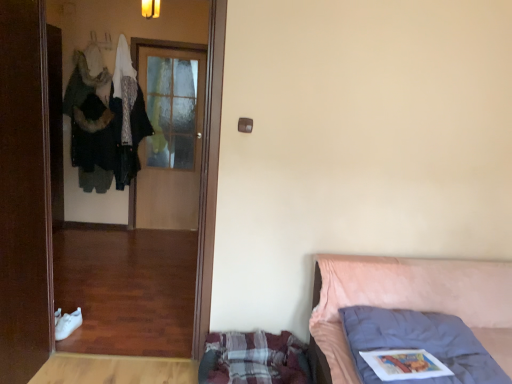
Question: From their relative heights in the image, would you say brown wooden door at left, the first door from the front, is taller or shorter than wooden door at center, which is counted as the second door, starting from the front?

Choices:
 (A) short
 (B) tall

Answer: (A)

Question: From a real-world perspective, relative to wooden door at center, which is counted as the second door, starting from the front, is brown wooden door at left, the first door from the front, vertically above or below?

Choices:
 (A) below
 (B) above

Answer: (A)

Question: Which is farther from the plaid fabric mattress at lower center?

Choices:
 (A) pink fabric bed at right
 (B) wooden screen door at left
 (C) wooden door at center, which is counted as the second door, starting from the front
 (D) brown wooden door at left, the first door from the front

Answer: (C)

Question: Estimate the real-world distances between objects in this image. Which object is farther from the wooden door at center, which is counted as the second door, starting from the front?

Choices:
 (A) plaid fabric mattress at lower center
 (B) wooden screen door at left
 (C) brown wooden door at left, marked as the 2th door in a back-to-front arrangement
 (D) pink fabric bed at right

Answer: (D)